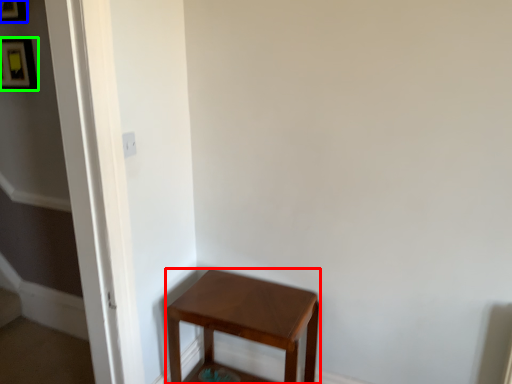
Question: Which is farther away from stool (highlighted by a red box)? picture frame (highlighted by a blue box) or picture frame (highlighted by a green box)?

Choices:
 (A) picture frame
 (B) picture frame

Answer: (A)